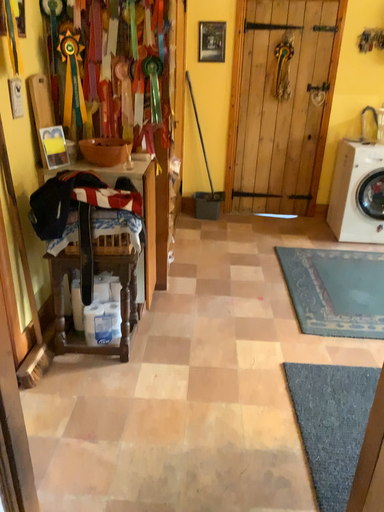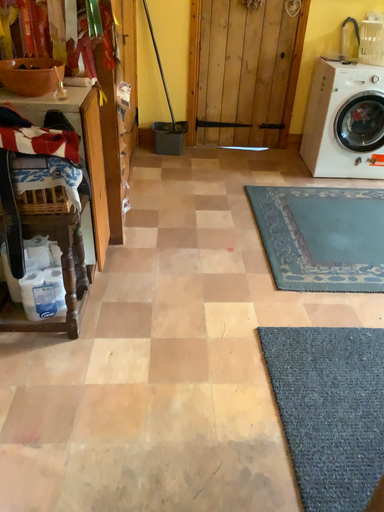
Question: Which way did the camera rotate in the video?

Choices:
 (A) rotated downward
 (B) rotated upward

Answer: (A)